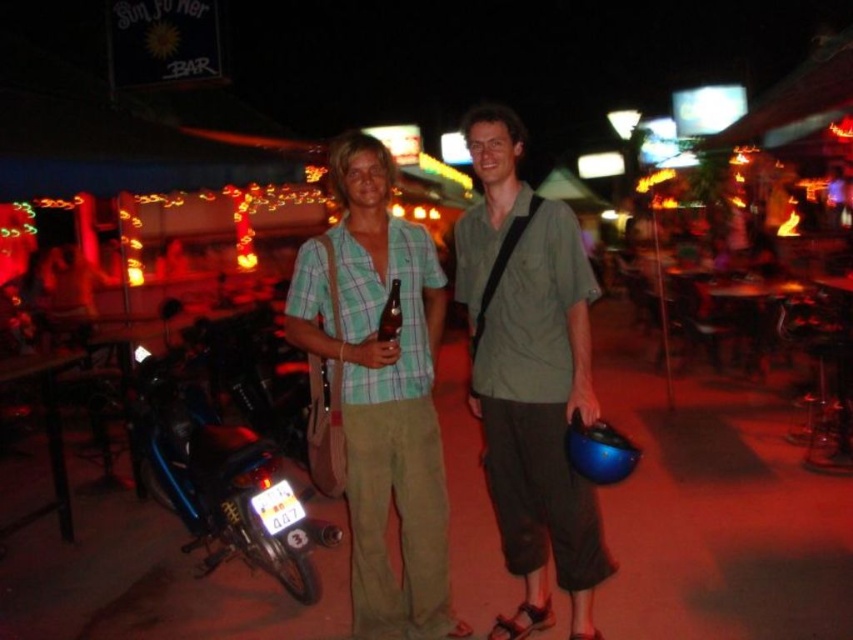
Does point (511, 157) come in front of point (231, 480)?

That is True.

Does green cotton shirt at center appear under metallic blue motorcycle at lower left?

No, green cotton shirt at center is not below metallic blue motorcycle at lower left.

Where is `green cotton shirt at center`? green cotton shirt at center is located at coordinates (529, 376).

In order to click on green cotton shirt at center in this screenshot , I will do `click(529, 376)`.

Is point (390, 177) positioned before point (225, 508)?

Yes, it is.

Is green plaid shirt at center wider than metallic blue motorcycle at lower left?

In fact, green plaid shirt at center might be narrower than metallic blue motorcycle at lower left.

Who is more forward, (352,296) or (165,442)?

Point (352,296) is more forward.

Identify the location of green plaid shirt at center. (381, 394).

The width and height of the screenshot is (853, 640). Identify the location of green cotton shirt at center. (529, 376).

Which is in front, point (531, 531) or point (413, 538)?

Point (413, 538) is in front.

Locate an element on the screen. The height and width of the screenshot is (640, 853). green cotton shirt at center is located at coordinates (529, 376).